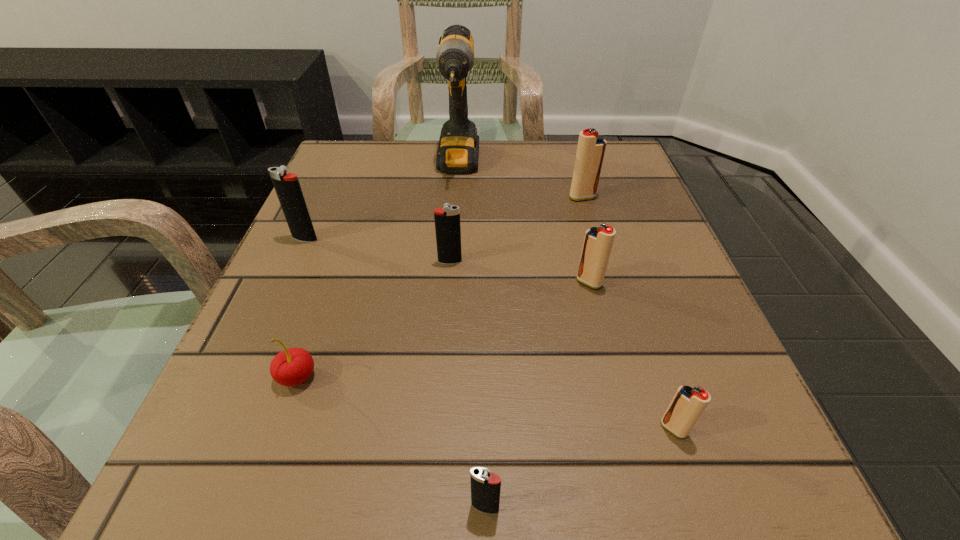
I want to click on blank space located on the back of the sixth farthest object, so click(x=345, y=240).

Locate an element on the screen. The image size is (960, 540). free space located on the front of the seventh farthest object is located at coordinates (691, 481).

This screenshot has width=960, height=540. Find the location of `free space located on the back of the rightmost black igniter`. free space located on the back of the rightmost black igniter is located at coordinates (484, 377).

The width and height of the screenshot is (960, 540). In order to click on drill that is at the far edge in this screenshot , I will do `click(458, 150)`.

Identify the location of igniter at the far edge. The height and width of the screenshot is (540, 960). (591, 147).

In order to click on object located in the near edge section of the desktop in this screenshot , I will do `click(485, 486)`.

Locate an element on the screen. The image size is (960, 540). igniter present at the left edge is located at coordinates (287, 186).

Where is `cherry located in the left edge section of the desktop`? This screenshot has height=540, width=960. cherry located in the left edge section of the desktop is located at coordinates (293, 366).

At what (x,y) coordinates should I click in order to perform the action: click on object situated at the far right corner. Please return your answer as a coordinate pair (x, y). Image resolution: width=960 pixels, height=540 pixels. Looking at the image, I should click on (591, 147).

This screenshot has height=540, width=960. What are the coordinates of `vacant space at the far edge of the desktop` in the screenshot? It's located at (407, 164).